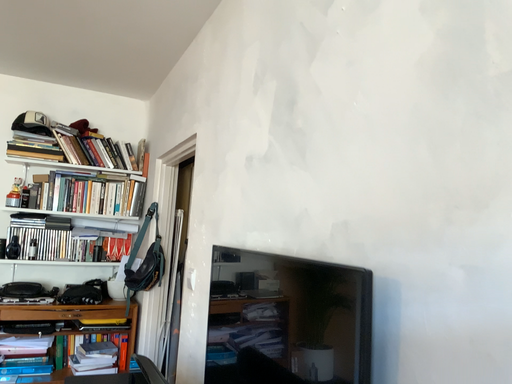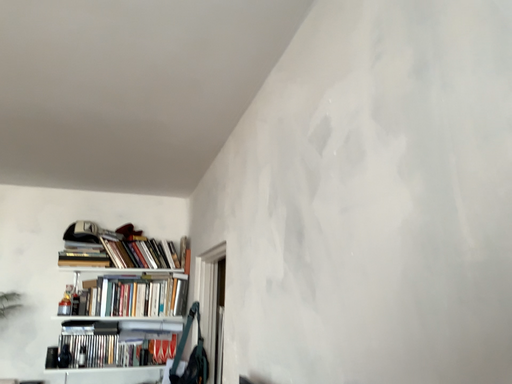
Question: How did the camera likely rotate when shooting the video?

Choices:
 (A) rotated left
 (B) rotated right

Answer: (A)